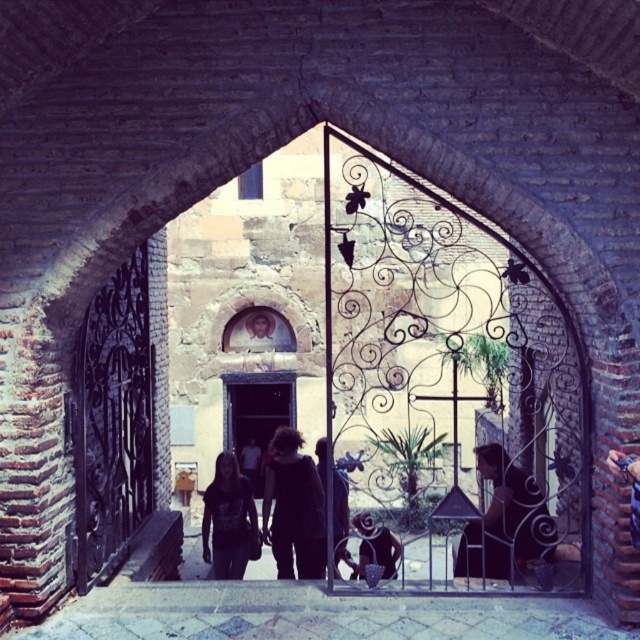
You are a delivery person trying to enter through the arched brick doorway. You see the dark wrought iron gate at left and the dark fabric dress at center. Which object is narrower, and can you pass through the narrower one to enter?

The dark wrought iron gate at left is narrower than the dark fabric dress at center. Since you are a delivery person, you can pass through the narrower dark wrought iron gate at left to enter.

You are a visitor standing in front of the arched brick doorway. You notice the dark wrought iron gate at left and the dark fabric dress at center. Which object is taller?

The dark fabric dress at center is taller than the dark wrought iron gate at left.

You are standing in front of the arched brick doorway and notice a point marked at coordinates (506,522). Based on the scene description, what object or feature is located at that point?

The point at coordinates (506,522) is located on dark hair at center.